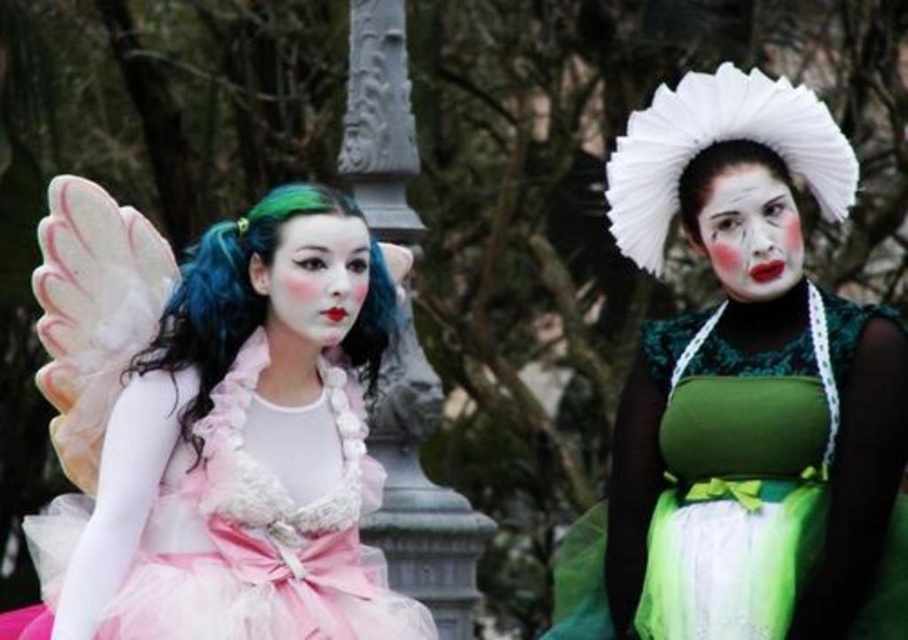
Does matte pink tulle dress at left have a smaller size compared to matte pink tulle face at center?

Actually, matte pink tulle dress at left might be larger than matte pink tulle face at center.

Is point (272, 337) farther from viewer compared to point (328, 330)?

Yes, it is.

Is point (270, 612) farther from viewer compared to point (293, 236)?

No, it is in front of (293, 236).

The width and height of the screenshot is (908, 640). What are the coordinates of `matte pink tulle dress at left` in the screenshot? It's located at (213, 424).

Which of these two, matte pink tulle dress at left or white feathered wig at upper center, stands taller?

matte pink tulle dress at left is taller.

Which is more to the left, matte pink tulle dress at left or white feathered wig at upper center?

matte pink tulle dress at left is more to the left.

Is point (243, 515) positioned before point (686, 216)?

Yes, it is in front of point (686, 216).

The height and width of the screenshot is (640, 908). In order to click on matte pink tulle dress at left in this screenshot , I will do `click(213, 424)`.

Is matte pink tulle dress at left further to the viewer compared to matte white face at center?

No.

Does matte pink tulle dress at left have a smaller size compared to matte white face at center?

No.

Is point (309, 636) more distant than point (768, 264)?

No, (309, 636) is in front of (768, 264).

The image size is (908, 640). I want to click on matte pink tulle dress at left, so click(x=213, y=424).